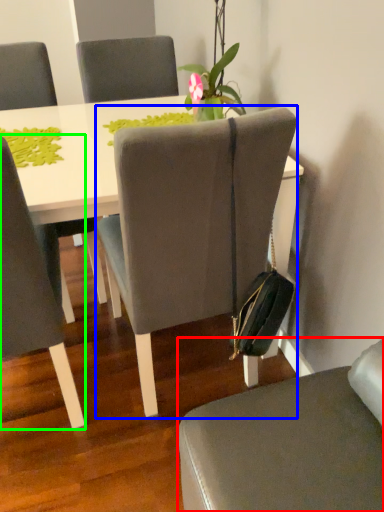
Question: Based on their relative distances, which object is farther from chair (highlighted by a red box)? Choose from chair (highlighted by a blue box) and chair (highlighted by a green box).

Choices:
 (A) chair
 (B) chair

Answer: (B)